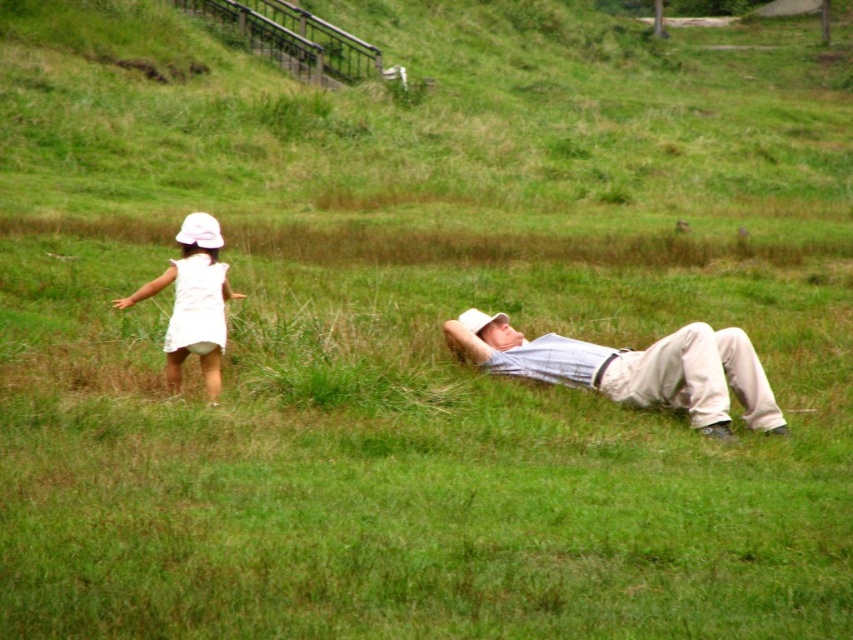
Question: Which of the following is the closest to the observer?

Choices:
 (A) light beige cotton pants at lower right
 (B) white cotton dress at left

Answer: (A)

Question: Does light beige cotton pants at lower right have a greater width compared to white cotton dress at left?

Choices:
 (A) yes
 (B) no

Answer: (A)

Question: Can you confirm if light beige cotton pants at lower right is positioned above white cotton dress at left?

Choices:
 (A) no
 (B) yes

Answer: (A)

Question: Among these objects, which one is nearest to the camera?

Choices:
 (A) white cotton dress at left
 (B) light beige cotton pants at lower right

Answer: (B)

Question: In this image, where is light beige cotton pants at lower right located relative to white cotton dress at left?

Choices:
 (A) above
 (B) below

Answer: (B)